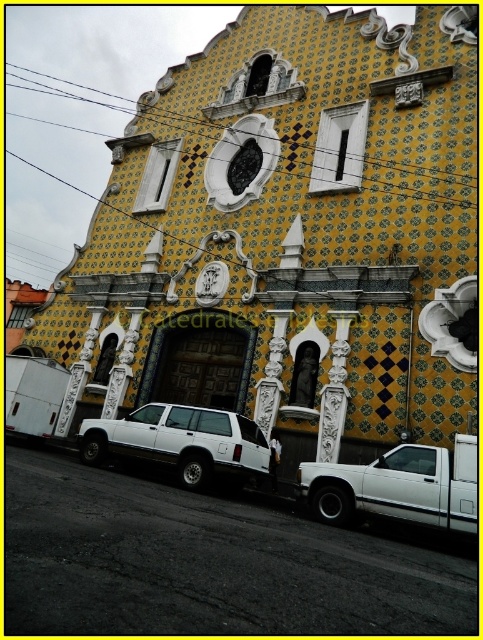
You are standing at point (287, 237) in the image. What object are you standing on?

You are standing on the yellow mosaic tile church at center.

You are standing in front of the building and want to take a photo. There are two points marked on the ground in front of you at coordinates point (415, 321) and point (420, 449). Which point is closer to your camera position?

Point (415, 321) is further to the camera than point (420, 449), so the point closer to the camera position is point (420, 449).

You are a delivery driver who needs to back out of the parking spot next to the yellow mosaic tile church at center and the white matte truck at lower right. Which vehicle is positioned higher up in the parking area?

The yellow mosaic tile church at center is above the white matte truck at lower right, so the yellow mosaic tile church at center is positioned higher up in the parking area.